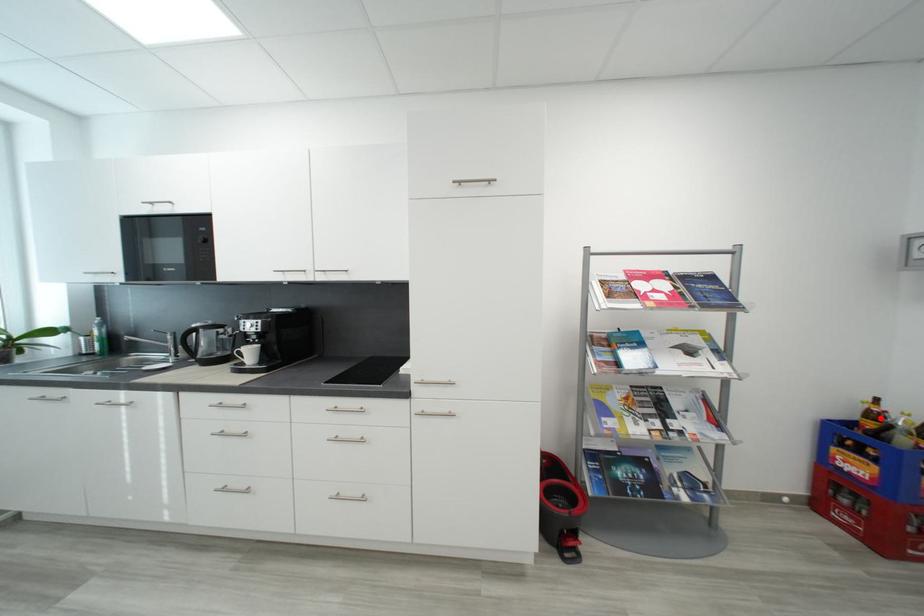
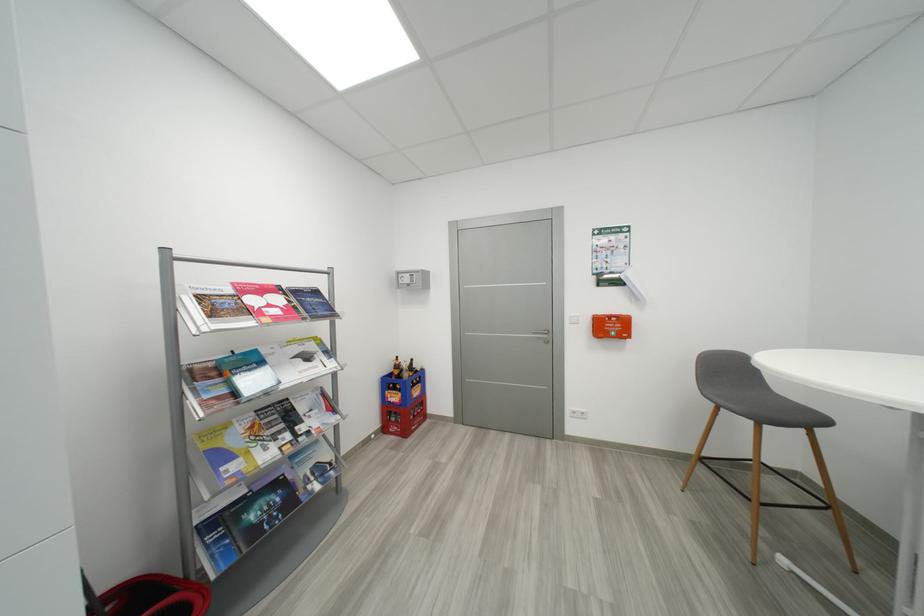
In the second image, find the point that corresponds to the highlighted location in the first image.

(404, 369)